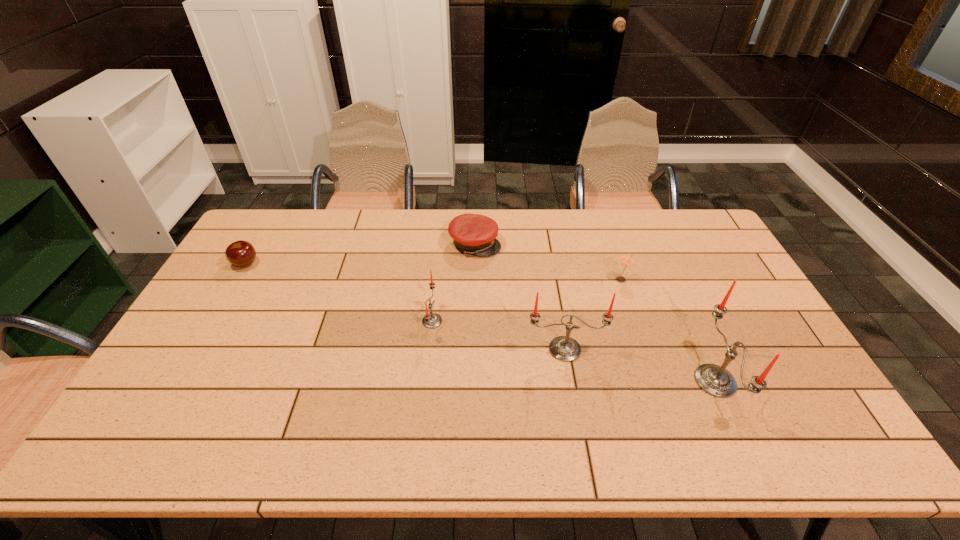
Where is `free region located 0.390m on the front-facing side of the rightmost object`? Image resolution: width=960 pixels, height=540 pixels. free region located 0.390m on the front-facing side of the rightmost object is located at coordinates (546, 381).

The image size is (960, 540). I want to click on vacant space located 0.250m on the front-facing side of the rightmost object, so click(x=600, y=381).

Where is `vacant region located 0.330m on the front-facing side of the rightmost object`? This screenshot has height=540, width=960. vacant region located 0.330m on the front-facing side of the rightmost object is located at coordinates (569, 381).

Where is `free region located on the front of the apple`? This screenshot has height=540, width=960. free region located on the front of the apple is located at coordinates (193, 353).

This screenshot has height=540, width=960. Identify the location of free space located 0.130m on the front of the cap with an emblem. (538, 244).

I want to click on vacant area located on the right of the straw, so click(x=665, y=280).

Where is `object that is at the far edge`? The height and width of the screenshot is (540, 960). object that is at the far edge is located at coordinates (476, 234).

Identify the location of object present at the near edge. This screenshot has height=540, width=960. (715, 380).

Locate an element on the screen. The height and width of the screenshot is (540, 960). object present at the left edge is located at coordinates (240, 253).

Find the location of a particular element. This screenshot has height=540, width=960. vacant region at the far edge is located at coordinates (640, 238).